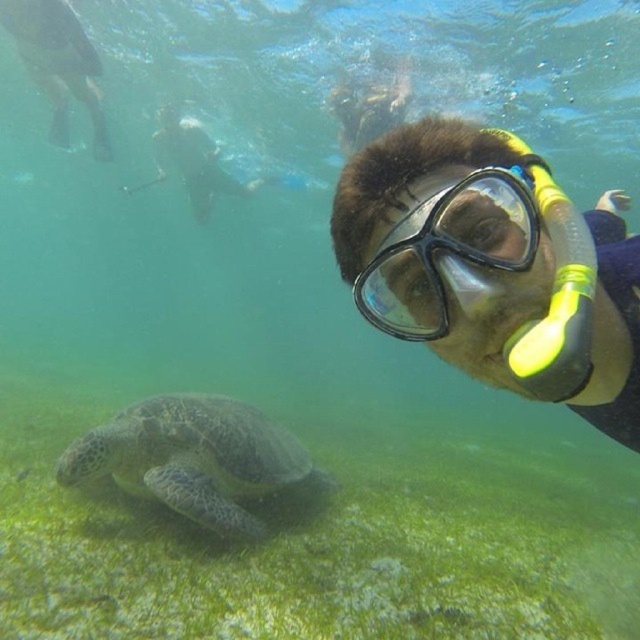
Does clear plastic mask at center appear on the left side of green matte turtle at lower left?

No, clear plastic mask at center is not to the left of green matte turtle at lower left.

Is point (442, 198) positioned behind point (102, 458)?

No.

Identify the location of clear plastic mask at center. (445, 243).

Which is above, green matte turtle at lower left or black matte scuba mask at upper right?

black matte scuba mask at upper right is above.

I want to click on green matte turtle at lower left, so click(193, 458).

Between point (520, 193) and point (512, 186), which one is positioned in front?

Positioned in front is point (520, 193).

Which is more to the right, clear plastic mask at center or black matte scuba mask at upper right?

clear plastic mask at center

Is point (525, 243) farther from viewer compared to point (435, 224)?

Yes, it is.

At what (x,y) coordinates should I click in order to perform the action: click on clear plastic mask at center. Please return your answer as a coordinate pair (x, y). This screenshot has height=640, width=640. Looking at the image, I should click on (445, 243).